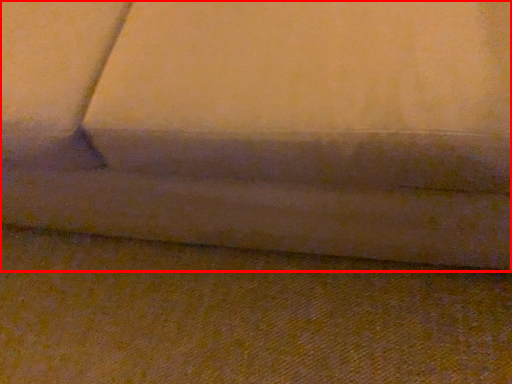
Question: From the image's perspective, where is studio couch (annotated by the red box) located relative to surface?

Choices:
 (A) above
 (B) below

Answer: (A)